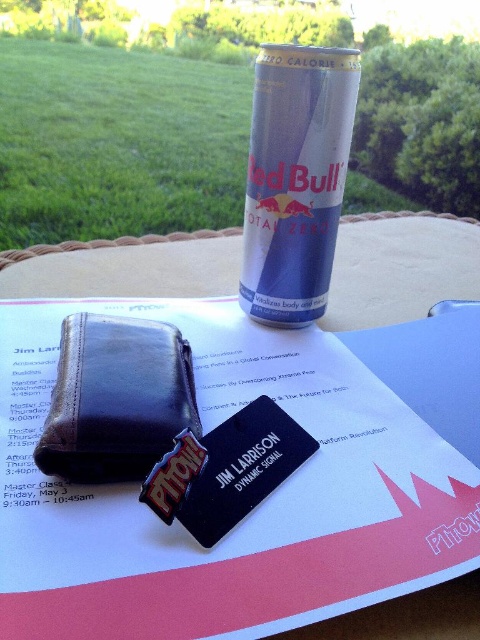
Does brown leather wallet at upper left appear over blue metallic red bull can at upper center?

No.

Can you confirm if brown leather wallet at upper left is smaller than blue metallic red bull can at upper center?

No, brown leather wallet at upper left is not smaller than blue metallic red bull can at upper center.

Who is more distant from viewer, [448,618] or [313,131]?

Point [313,131]

Identify the location of brown leather wallet at upper left. pyautogui.click(x=400, y=266).